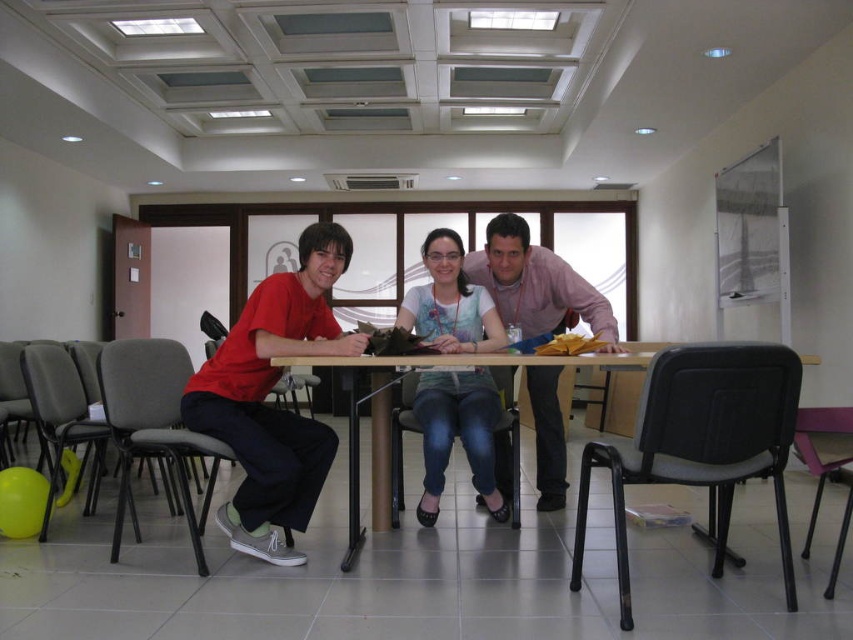
Question: Which of the following is the closest to the observer?

Choices:
 (A) matte red shirt at left
 (B) matte white shirt at center
 (C) wooden table at center

Answer: (C)

Question: Which object is farther from the camera taking this photo?

Choices:
 (A) wooden table at center
 (B) matte white shirt at center

Answer: (B)

Question: Does matte white shirt at center have a larger size compared to wooden table at center?

Choices:
 (A) no
 (B) yes

Answer: (A)

Question: From the image, what is the correct spatial relationship of matte red shirt at left in relation to matte white shirt at center?

Choices:
 (A) right
 (B) left

Answer: (B)

Question: Is matte red shirt at left behind matte white shirt at center?

Choices:
 (A) no
 (B) yes

Answer: (A)

Question: Estimate the real-world distances between objects in this image. Which object is closer to the matte red shirt at left?

Choices:
 (A) matte white shirt at center
 (B) wooden table at center

Answer: (B)